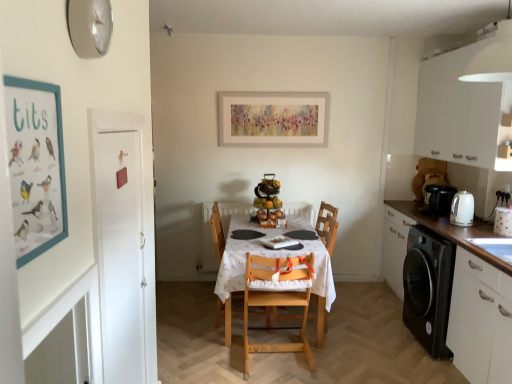
Locate an element on the screen. The width and height of the screenshot is (512, 384). vacant region to the left of white ceramic kettle at right, which is the second appliance from left to right is located at coordinates (482, 233).